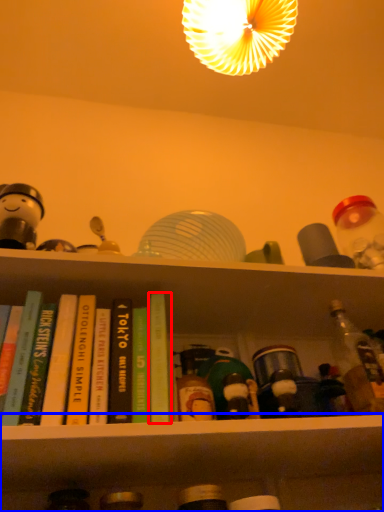
Question: Which object is further to the camera taking this photo, book (highlighted by a red box) or shelf (highlighted by a blue box)?

Choices:
 (A) book
 (B) shelf

Answer: (A)